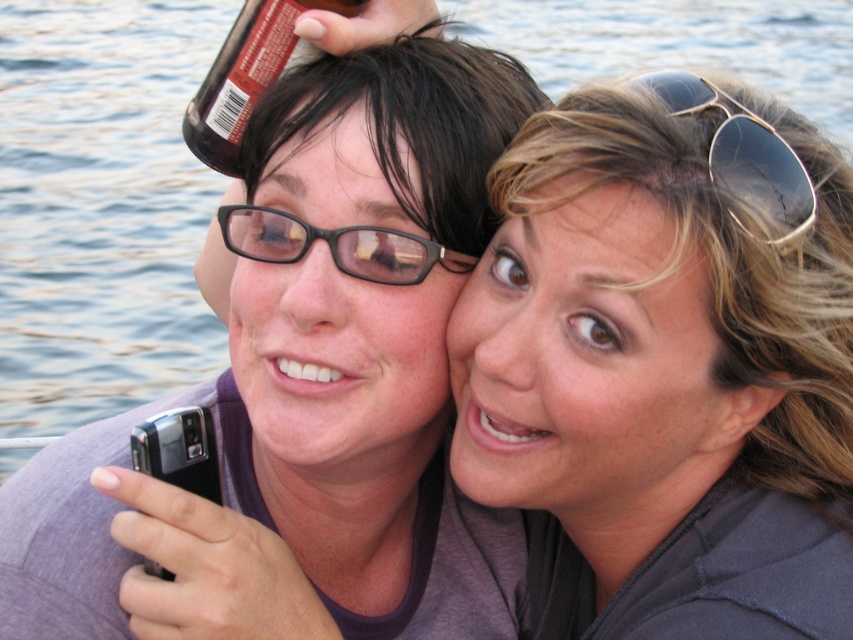
Based on the coordinates provided in the scene description, where is the blonde hair at upper right positioned?

The blonde hair at upper right is located at point (x=665, y=365).

You are a photographer trying to capture the scene with the matte black phone at center and the brown glass bottle at upper center. Which object should you adjust your focus to first if you want to ensure both are in frame?

The matte black phone at center is positioned on the right side of brown glass bottle at upper center. To ensure both are in frame, focus on the brown glass bottle at upper center first as it is closer to the center and the phone is to its right, allowing adjustment from there.

You are a photographer adjusting the focus on your camera. You notice two items in the scene that might interfere with the focus if they are too close to the lens. The sunglasses at upper right and the black plastic glasses at center. Which item is more likely to cause a focusing issue because it is closer to the camera?

The sunglasses at upper right is thinner than black plastic glasses at center, but the question is about which is closer. Since the description only states the sunglasses are thinner, we cannot determine distance from this information. Therefore, the answer cannot be determined based on the provided details.